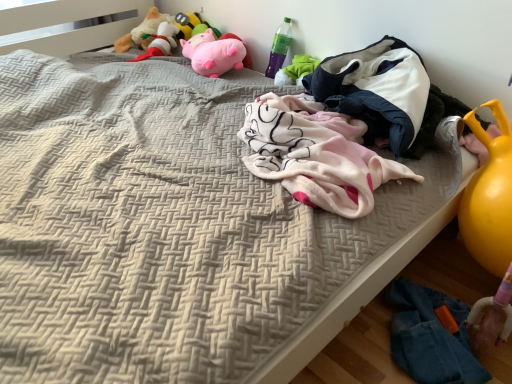
From the picture: Measure the distance between point (426, 382) and camera.

Point (426, 382) and camera are 3.59 feet apart from each other.

You are a GUI agent. You are given a task and a screenshot of the screen. Output one action in this format:
    pyautogui.click(x=<x>, y=<y>)
    Task: Click on the denim jeans at lower right
    This screenshot has height=384, width=512.
    Given the screenshot: What is the action you would take?
    pyautogui.click(x=431, y=336)

At what (x,y) coordinates should I click in order to perform the action: click on pink plush toy at upper center, the second toy from the right. Please return your answer as a coordinate pair (x, y). The height and width of the screenshot is (384, 512). Looking at the image, I should click on (186, 24).

Find the location of a particular element. green plastic bottle at upper right is located at coordinates (279, 48).

Find the location of a particular element. denim jeans at lower right is located at coordinates (431, 336).

Which of these two, pink plush pig at upper center, the first toy in the right-to-left sequence, or fluffy beige stuffed animal at upper left, placed as the 1th toy when sorted from left to right, is smaller?

fluffy beige stuffed animal at upper left, placed as the 1th toy when sorted from left to right.

Is pink plush pig at upper center, which is counted as the 4th toy, starting from the left, looking in the opposite direction of fluffy beige stuffed animal at upper left, placed as the 1th toy when sorted from left to right?

No, pink plush pig at upper center, which is counted as the 4th toy, starting from the left,'s orientation is not away from fluffy beige stuffed animal at upper left, placed as the 1th toy when sorted from left to right.

Locate an element on the screen. the 3rd toy below the fluffy beige stuffed animal at upper left, which is counted as the fourth toy, starting from the right (from the image's perspective) is located at coordinates (214, 53).

From the image's perspective, is pink plush pig at upper center, the first toy in the right-to-left sequence, under fluffy beige stuffed animal at upper left, which is counted as the fourth toy, starting from the right?

Indeed, from the image's perspective, pink plush pig at upper center, the first toy in the right-to-left sequence, is shown beneath fluffy beige stuffed animal at upper left, which is counted as the fourth toy, starting from the right.

From the image's perspective, between pink plush pig at upper center, which is counted as the 4th toy, starting from the left, and white soft blanket at upper right, who is located below?

white soft blanket at upper right is shown below in the image.

Find the location of a particular element. The width and height of the screenshot is (512, 384). baby clothe that is below the pink plush pig at upper center, which is counted as the 4th toy, starting from the left (from the image's perspective) is located at coordinates click(376, 91).

Can you confirm if pink plush pig at upper center, which is counted as the 4th toy, starting from the left, is positioned to the right of white soft blanket at upper right?

In fact, pink plush pig at upper center, which is counted as the 4th toy, starting from the left, is to the left of white soft blanket at upper right.

From the image's perspective, is pink plush pig at upper center, the first toy in the right-to-left sequence, on top of denim jeans at lower right?

Yes, from the image's perspective, pink plush pig at upper center, the first toy in the right-to-left sequence, is above denim jeans at lower right.

Based on the photo, does pink plush pig at upper center, the first toy in the right-to-left sequence, have a greater height compared to denim jeans at lower right?

Correct, pink plush pig at upper center, the first toy in the right-to-left sequence, is much taller as denim jeans at lower right.

Is pink plush pig at upper center, the first toy in the right-to-left sequence, not near denim jeans at lower right?

Yes, pink plush pig at upper center, the first toy in the right-to-left sequence, is far from denim jeans at lower right.

Considering the sizes of pink plush pig at upper center, the first toy in the right-to-left sequence, and denim jeans at lower right in the image, is pink plush pig at upper center, the first toy in the right-to-left sequence, bigger or smaller than denim jeans at lower right?

Considering their sizes, pink plush pig at upper center, the first toy in the right-to-left sequence, takes up more space than denim jeans at lower right.

Is pink plush toy at upper center, the second toy from the right, to the right of green plastic bottle at upper right from the viewer's perspective?

No.

Is pink plush toy at upper center, the second toy from the right, located outside green plastic bottle at upper right?

Indeed, pink plush toy at upper center, the second toy from the right, is completely outside green plastic bottle at upper right.

Based on the photo, how much distance is there between pink plush toy at upper center, the third toy from the left, and green plastic bottle at upper right?

pink plush toy at upper center, the third toy from the left, and green plastic bottle at upper right are 20.74 inches apart from each other.

Can you tell me how much pink plush toy at upper center, the second toy from the right, and green plastic bottle at upper right differ in facing direction?

The facing directions of pink plush toy at upper center, the second toy from the right, and green plastic bottle at upper right are 0.858 degrees apart.

Is fluffy plush toy at upper left, marked as the 2th toy in a left-to-right arrangement, directly adjacent to green plastic bottle at upper right?

No, fluffy plush toy at upper left, marked as the 2th toy in a left-to-right arrangement, is not next to green plastic bottle at upper right.

How many degrees apart are the facing directions of fluffy plush toy at upper left, marked as the 2th toy in a left-to-right arrangement, and green plastic bottle at upper right?

They differ by 0.858 degrees in their facing directions.

Does fluffy plush toy at upper left, marked as the 2th toy in a left-to-right arrangement, have a smaller size compared to green plastic bottle at upper right?

No.

From a real-world perspective, which object stands above the other?

From a 3D spatial view, green plastic bottle at upper right is above.

Is denim jeans at lower right not inside green plastic bottle at upper right?

Indeed, denim jeans at lower right is completely outside green plastic bottle at upper right.

From a real-world perspective, is denim jeans at lower right physically below green plastic bottle at upper right?

Yes, from a real-world perspective, denim jeans at lower right is beneath green plastic bottle at upper right.

Is denim jeans at lower right facing away from green plastic bottle at upper right?

No, denim jeans at lower right is not facing the opposite direction of green plastic bottle at upper right.

Would you consider denim jeans at lower right to be distant from green plastic bottle at upper right?

Yes, denim jeans at lower right is far from green plastic bottle at upper right.

Is pink plush pig at upper center, the first toy in the right-to-left sequence, not close to green plastic bottle at upper right?

No, pink plush pig at upper center, the first toy in the right-to-left sequence, is not far from green plastic bottle at upper right.

Is pink plush pig at upper center, the first toy in the right-to-left sequence, in front of or behind green plastic bottle at upper right in the image?

pink plush pig at upper center, the first toy in the right-to-left sequence, is behind green plastic bottle at upper right.

Considering the relative positions of pink plush pig at upper center, the first toy in the right-to-left sequence, and green plastic bottle at upper right in the image provided, is pink plush pig at upper center, the first toy in the right-to-left sequence, to the right of green plastic bottle at upper right from the viewer's perspective?

In fact, pink plush pig at upper center, the first toy in the right-to-left sequence, is to the left of green plastic bottle at upper right.

Find the location of a particular element. The width and height of the screenshot is (512, 384). the 3rd toy directly above the pink plush pig at upper center, which is counted as the 4th toy, starting from the left (from a real-world perspective) is located at coordinates (142, 32).

This screenshot has width=512, height=384. I want to click on the 1st toy to the left of the white soft blanket at upper right, starting your count from the anchor, so 214,53.

Considering their positions, is white soft blanket at upper right positioned further to fluffy beige stuffed animal at upper left, which is counted as the fourth toy, starting from the right, than green plastic bottle at upper right?

white soft blanket at upper right is positioned further to the anchor fluffy beige stuffed animal at upper left, which is counted as the fourth toy, starting from the right.

Which object lies further to the anchor point fluffy plush toy at upper left, positioned as the 3th toy in right-to-left order, pink plush pig at upper center, the first toy in the right-to-left sequence, or green plastic bottle at upper right?

green plastic bottle at upper right lies further to fluffy plush toy at upper left, positioned as the 3th toy in right-to-left order, than the other object.

Which object lies further to the anchor point green plastic bottle at upper right, pink plush pig at upper center, the first toy in the right-to-left sequence, or white soft blanket at upper right?

white soft blanket at upper right is positioned further to the anchor green plastic bottle at upper right.

Considering their positions, is fluffy beige stuffed animal at upper left, which is counted as the fourth toy, starting from the right, positioned closer to pink plush toy at upper center, the second toy from the right, than white soft blanket at upper right?

fluffy beige stuffed animal at upper left, which is counted as the fourth toy, starting from the right, is positioned closer to the anchor pink plush toy at upper center, the second toy from the right.

Considering their positions, is fluffy plush toy at upper left, marked as the 2th toy in a left-to-right arrangement, positioned further to denim jeans at lower right than pink plush pig at upper center, the first toy in the right-to-left sequence?

fluffy plush toy at upper left, marked as the 2th toy in a left-to-right arrangement, lies further to denim jeans at lower right than the other object.

Based on their spatial positions, is pink plush pig at upper center, which is counted as the 4th toy, starting from the left, or white soft blanket at upper right closer to pink plush toy at upper center, the third toy from the left?

pink plush pig at upper center, which is counted as the 4th toy, starting from the left, is closer to pink plush toy at upper center, the third toy from the left.

Considering their positions, is pink plush toy at upper center, the third toy from the left, positioned closer to green plastic bottle at upper right than fluffy plush toy at upper left, positioned as the 3th toy in right-to-left order?

pink plush toy at upper center, the third toy from the left, is positioned closer to the anchor green plastic bottle at upper right.

Looking at the image, which one is located closer to pink plush pig at upper center, which is counted as the 4th toy, starting from the left, denim jeans at lower right or pink plush toy at upper center, the second toy from the right?

The object closer to pink plush pig at upper center, which is counted as the 4th toy, starting from the left, is pink plush toy at upper center, the second toy from the right.

This screenshot has height=384, width=512. I want to click on bottle positioned between white soft blanket at upper right and pink plush pig at upper center, which is counted as the 4th toy, starting from the left, from near to far, so click(x=279, y=48).

In order to click on bottle located between fluffy plush toy at upper left, positioned as the 3th toy in right-to-left order, and white soft blanket at upper right in the left-right direction in this screenshot , I will do `click(279, 48)`.

Locate an element on the screen. The width and height of the screenshot is (512, 384). toy between fluffy beige stuffed animal at upper left, placed as the 1th toy when sorted from left to right, and pink plush toy at upper center, the second toy from the right, from left to right is located at coordinates (159, 32).

You are a GUI agent. You are given a task and a screenshot of the screen. Output one action in this format:
    pyautogui.click(x=<x>, y=<y>)
    Task: Click on the bottle between fluffy beige stuffed animal at upper left, placed as the 1th toy when sorted from left to right, and denim jeans at lower right, in the vertical direction
    Image resolution: width=512 pixels, height=384 pixels.
    Given the screenshot: What is the action you would take?
    pyautogui.click(x=279, y=48)